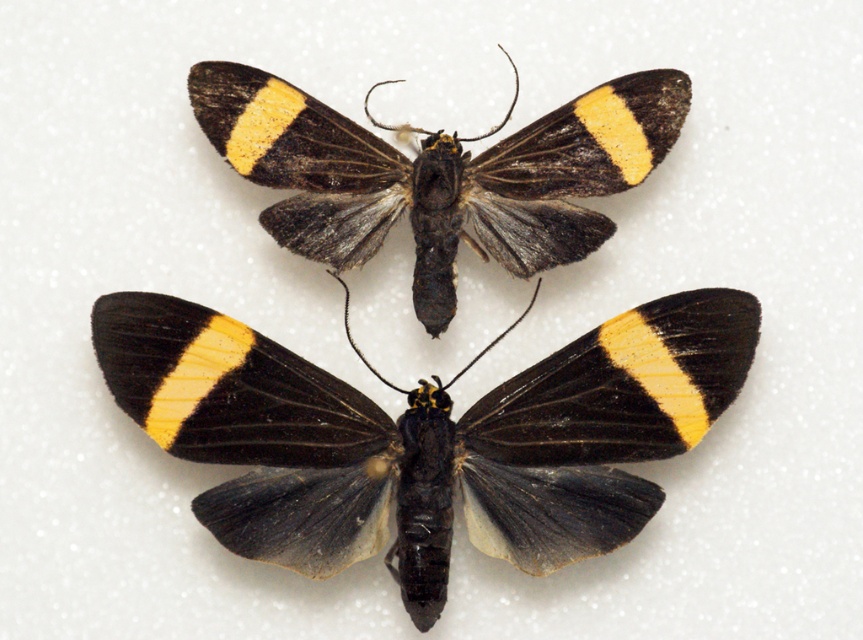
You are an entomologist examining two moths displayed against a white background. You notice a point labeled at coordinates point (426, 436). Which object does this point correspond to?

The point (426, 436) corresponds to the black matte butterfly at center.

You are an entomologist examining a collection of preserved insects. You need to locate the black matte butterfly at center in your catalog. According to the coordinates provided, where exactly is it positioned in the image?

The black matte butterfly at center is positioned at the 2D coordinates point (426, 436).